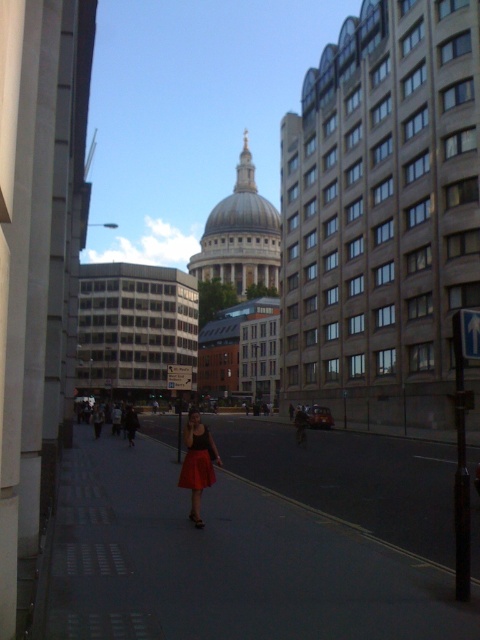
You are a photographer trying to capture the woman in the matte red skirt at center while ensuring the smooth concrete sidewalk at center is clearly visible in the background. Given their relative heights, will the sidewalk be visible above or below the skirt in the photo?

The smooth concrete sidewalk at center is much taller than the matte red skirt at center, so in the photo, the sidewalk will appear above the skirt.

You are a photographer standing on the sidewalk at the scene of St. Paul Cathedral. You want to capture a photo of the matte red skirt at center without the smooth concrete sidewalk at center appearing in the foreground. Is this possible?

The smooth concrete sidewalk at center is below the matte red skirt at center, so if you position yourself so that the sidewalk is not in front of the skirt, you can avoid it. However, since the sidewalk is below the skirt, adjusting the camera angle upwards might help exclude the sidewalk from the foreground.